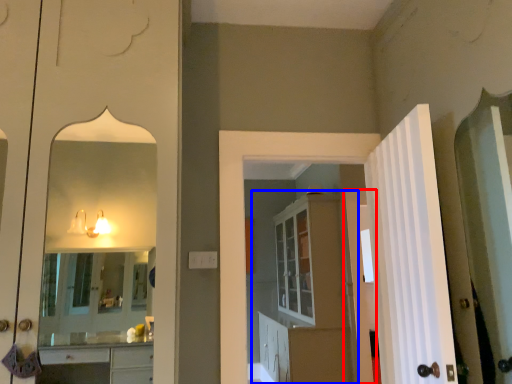
Question: Which object appears closest to the camera in this image, door (highlighted by a red box) or dresser (highlighted by a blue box)?

Choices:
 (A) door
 (B) dresser

Answer: (B)